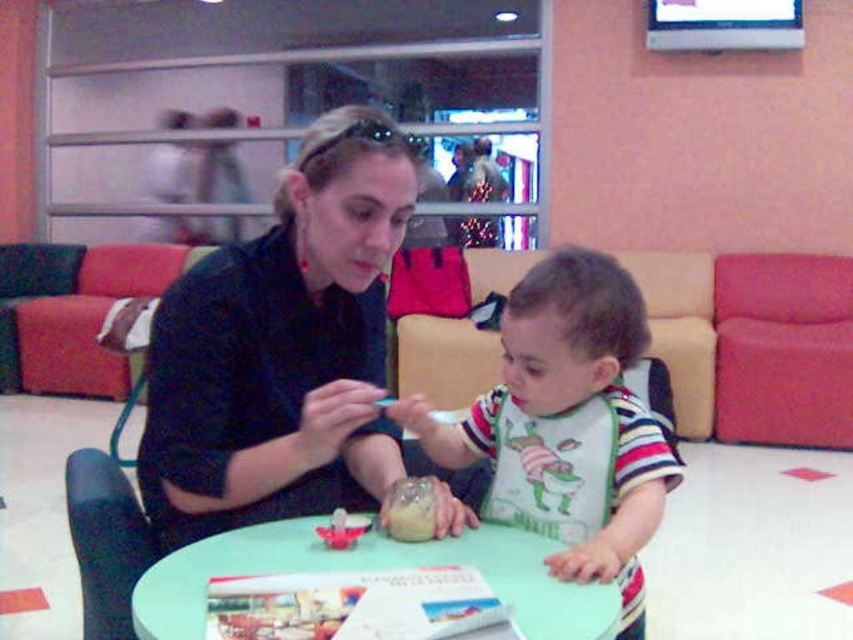
You are a photographer trying to capture a candid shot of the scene. You want to ensure that both the matte black shirt at center and the translucent plastic cup at table are clearly visible in your photo. Based on their positions, which object should you focus on first to ensure both are in focus?

The matte black shirt at center is positioned on the left side of the translucent plastic cup at table. To ensure both are in focus, you should focus on the matte black shirt at center first since it is closer to the photographer, and the cup will naturally fall into the depth of field if focused on the shirt.